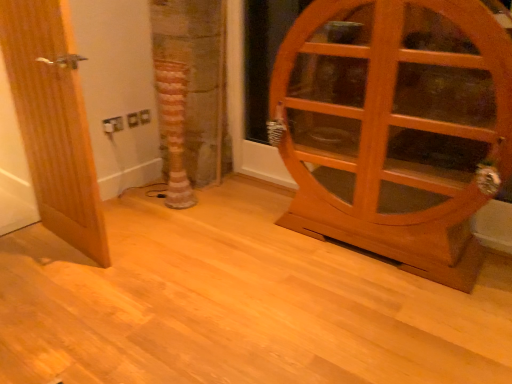
What is the approximate width of wooden door at left, the 2th door from the right?

6.87 centimeters.

The height and width of the screenshot is (384, 512). What do you see at coordinates (173, 129) in the screenshot?
I see `striped fabric tree trunk at center` at bounding box center [173, 129].

Where is `wooden cabinet at right, acting as the 1th door starting from the right`? wooden cabinet at right, acting as the 1th door starting from the right is located at coordinates (395, 129).

Where is `wooden door at left, the 2th door from the right`? The image size is (512, 384). wooden door at left, the 2th door from the right is located at coordinates (53, 121).

The image size is (512, 384). What are the coordinates of `door below the wooden cabinet at right, placed as the second door when sorted from left to right (from the image's perspective)` in the screenshot? It's located at (53, 121).

Does wooden door at left, which is counted as the 1th door, starting from the left, turn towards wooden cabinet at right, placed as the second door when sorted from left to right?

No.

Which of these two, wooden door at left, which is counted as the 1th door, starting from the left, or wooden cabinet at right, placed as the second door when sorted from left to right, is smaller?

Smaller between the two is wooden door at left, which is counted as the 1th door, starting from the left.

Can you confirm if wooden door at left, which is counted as the 1th door, starting from the left, is positioned to the right of wooden cabinet at right, acting as the 1th door starting from the right?

In fact, wooden door at left, which is counted as the 1th door, starting from the left, is to the left of wooden cabinet at right, acting as the 1th door starting from the right.

This screenshot has height=384, width=512. What are the coordinates of `door in front of the wooden door at left, which is counted as the 1th door, starting from the left` in the screenshot? It's located at (395, 129).

Could you tell me if wooden cabinet at right, acting as the 1th door starting from the right, is turned towards wooden door at left, the 2th door from the right?

No, wooden cabinet at right, acting as the 1th door starting from the right, is not facing towards wooden door at left, the 2th door from the right.

Which object is wider, wooden cabinet at right, acting as the 1th door starting from the right, or wooden door at left, which is counted as the 1th door, starting from the left?

wooden cabinet at right, acting as the 1th door starting from the right, is wider.

From the image's perspective, is wooden cabinet at right, placed as the second door when sorted from left to right, below wooden door at left, the 2th door from the right?

No, from the image's perspective, wooden cabinet at right, placed as the second door when sorted from left to right, is not below wooden door at left, the 2th door from the right.

Consider the image. Is striped fabric tree trunk at center situated inside wooden door at left, the 2th door from the right, or outside?

striped fabric tree trunk at center lies outside wooden door at left, the 2th door from the right.

Can you tell me how much striped fabric tree trunk at center and wooden door at left, which is counted as the 1th door, starting from the left, differ in facing direction?

There is a 3.13-degree angle between the facing directions of striped fabric tree trunk at center and wooden door at left, which is counted as the 1th door, starting from the left.

Considering the points (166, 122) and (91, 153), which point is in front, point (166, 122) or point (91, 153)?

The point (91, 153) is in front.

Is striped fabric tree trunk at center positioned with its back to wooden door at left, the 2th door from the right?

That's not correct — striped fabric tree trunk at center is not looking away from wooden door at left, the 2th door from the right.

Is striped fabric tree trunk at center in front of or behind wooden cabinet at right, acting as the 1th door starting from the right, in the image?

striped fabric tree trunk at center is behind wooden cabinet at right, acting as the 1th door starting from the right.

Locate an element on the screen. tree trunk above the wooden cabinet at right, placed as the second door when sorted from left to right (from the image's perspective) is located at coordinates (173, 129).

Is striped fabric tree trunk at center positioned far away from wooden cabinet at right, placed as the second door when sorted from left to right?

Yes, striped fabric tree trunk at center and wooden cabinet at right, placed as the second door when sorted from left to right, are located far from each other.

Is wooden cabinet at right, placed as the second door when sorted from left to right, positioned beyond the bounds of striped fabric tree trunk at center?

Yes, wooden cabinet at right, placed as the second door when sorted from left to right, is located beyond the bounds of striped fabric tree trunk at center.

Looking at this image, could you measure the distance between wooden cabinet at right, placed as the second door when sorted from left to right, and striped fabric tree trunk at center?

The distance of wooden cabinet at right, placed as the second door when sorted from left to right, from striped fabric tree trunk at center is 3.58 feet.

Who is smaller, wooden cabinet at right, placed as the second door when sorted from left to right, or striped fabric tree trunk at center?

Smaller between the two is striped fabric tree trunk at center.

Can you tell me how much wooden door at left, the 2th door from the right, and striped fabric tree trunk at center differ in facing direction?

wooden door at left, the 2th door from the right, and striped fabric tree trunk at center are facing 3.13 degrees away from each other.

Is wooden door at left, which is counted as the 1th door, starting from the left, shorter than striped fabric tree trunk at center?

Incorrect, the height of wooden door at left, which is counted as the 1th door, starting from the left, does not fall short of that of striped fabric tree trunk at center.

From a real-world perspective, which object rests below the other?

From a 3D spatial view, striped fabric tree trunk at center is below.

This screenshot has height=384, width=512. I want to click on door in front of the wooden door at left, which is counted as the 1th door, starting from the left, so click(395, 129).

Locate an element on the screen. This screenshot has width=512, height=384. door to the right of wooden door at left, which is counted as the 1th door, starting from the left is located at coordinates (395, 129).

Based on their spatial positions, is wooden door at left, which is counted as the 1th door, starting from the left, or striped fabric tree trunk at center closer to wooden cabinet at right, acting as the 1th door starting from the right?

Among the two, striped fabric tree trunk at center is located nearer to wooden cabinet at right, acting as the 1th door starting from the right.

Which object lies further to the anchor point wooden cabinet at right, placed as the second door when sorted from left to right, striped fabric tree trunk at center or wooden door at left, which is counted as the 1th door, starting from the left?

wooden door at left, which is counted as the 1th door, starting from the left, is positioned further to the anchor wooden cabinet at right, placed as the second door when sorted from left to right.

Considering their positions, is wooden cabinet at right, acting as the 1th door starting from the right, positioned closer to wooden door at left, which is counted as the 1th door, starting from the left, than striped fabric tree trunk at center?

Based on the image, striped fabric tree trunk at center appears to be nearer to wooden door at left, which is counted as the 1th door, starting from the left.

When comparing their distances from striped fabric tree trunk at center, does wooden door at left, which is counted as the 1th door, starting from the left, or wooden cabinet at right, acting as the 1th door starting from the right, seem closer?

Among the two, wooden door at left, which is counted as the 1th door, starting from the left, is located nearer to striped fabric tree trunk at center.

Estimate the real-world distances between objects in this image. Which object is closer to wooden door at left, which is counted as the 1th door, starting from the left, striped fabric tree trunk at center or wooden cabinet at right, placed as the second door when sorted from left to right?

The object closer to wooden door at left, which is counted as the 1th door, starting from the left, is striped fabric tree trunk at center.

Considering their positions, is wooden cabinet at right, placed as the second door when sorted from left to right, positioned further to striped fabric tree trunk at center than wooden door at left, which is counted as the 1th door, starting from the left?

The object further to striped fabric tree trunk at center is wooden cabinet at right, placed as the second door when sorted from left to right.

Locate an element on the screen. tree trunk located between wooden door at left, which is counted as the 1th door, starting from the left, and wooden cabinet at right, acting as the 1th door starting from the right, in the left-right direction is located at coordinates (173, 129).